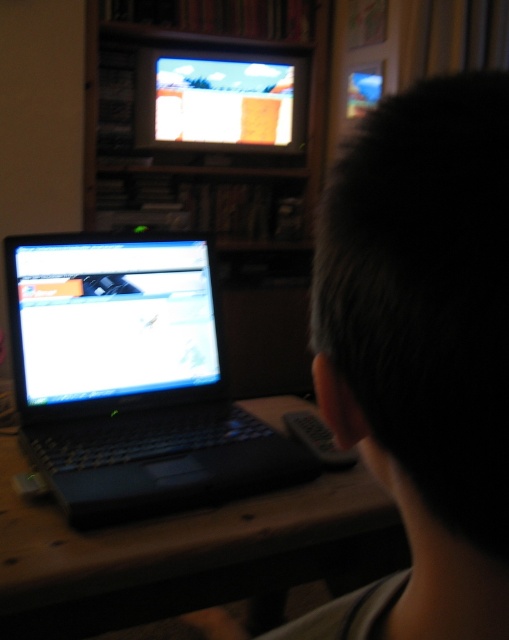
Question: Is wooden bookshelf at upper center wider than shiny black laptop at left?

Choices:
 (A) no
 (B) yes

Answer: (B)

Question: Among these objects, which one is farthest from the camera?

Choices:
 (A) dark hair at center
 (B) wooden table at center
 (C) matte plastic television at upper center
 (D) wooden bookshelf at upper center

Answer: (C)

Question: Does wooden bookshelf at upper center appear on the left side of shiny black laptop at left?

Choices:
 (A) no
 (B) yes

Answer: (A)

Question: Which point is farther from the camera taking this photo?

Choices:
 (A) (477, 528)
 (B) (50, 470)
 (C) (236, 568)

Answer: (C)

Question: Can you confirm if wooden bookshelf at upper center is bigger than matte plastic television at upper center?

Choices:
 (A) no
 (B) yes

Answer: (B)

Question: Estimate the real-world distances between objects in this image. Which object is closer to the dark hair at center?

Choices:
 (A) matte plastic television at upper center
 (B) shiny black laptop at left
 (C) wooden table at center

Answer: (C)